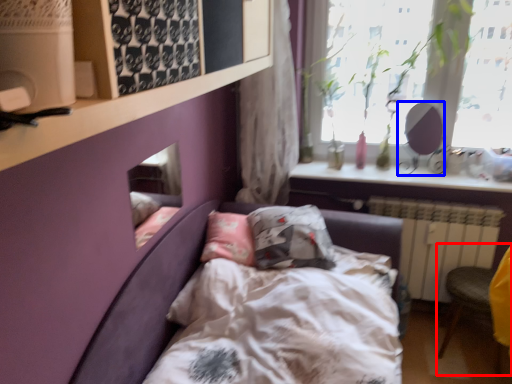
Question: Which point is further to the camera, armchair (highlighted by a red box) or mirror (highlighted by a blue box)?

Choices:
 (A) armchair
 (B) mirror

Answer: (B)